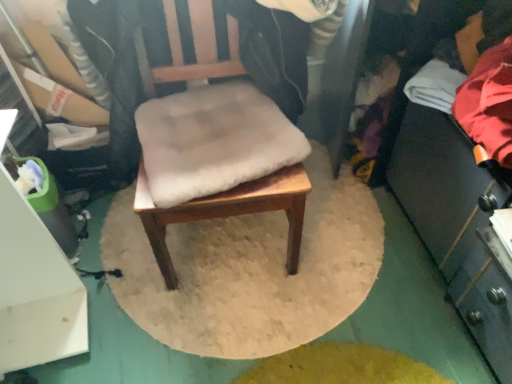
Question: Considering the positions of red fabric at right and wooden chair at center in the image, is red fabric at right taller or shorter than wooden chair at center?

Choices:
 (A) tall
 (B) short

Answer: (B)

Question: In the image, is red fabric at right on the left side or the right side of wooden chair at center?

Choices:
 (A) right
 (B) left

Answer: (A)

Question: Based on their relative distances, which object is nearer to the wooden chair at center?

Choices:
 (A) white soft cushion at center
 (B) red fabric at right

Answer: (A)

Question: Which object is the farthest from the wooden chair at center?

Choices:
 (A) red fabric at right
 (B) white soft cushion at center

Answer: (A)